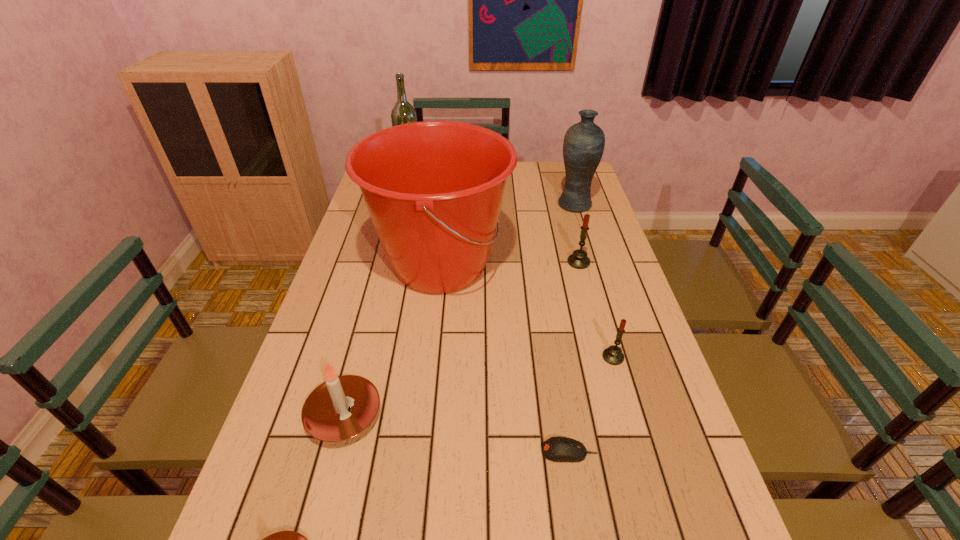
This screenshot has height=540, width=960. Find the location of `empty space that is in between the second farthest candle and the red bucket`. empty space that is in between the second farthest candle and the red bucket is located at coordinates (527, 311).

This screenshot has height=540, width=960. Identify the location of free space between the third farthest candle and the farthest object. (377, 296).

The height and width of the screenshot is (540, 960). Find the location of `vacant space in between the vase and the bucket`. vacant space in between the vase and the bucket is located at coordinates (508, 235).

Locate an element on the screen. vacant area between the third nearest candle and the red bucket is located at coordinates pos(527,311).

You are a GUI agent. You are given a task and a screenshot of the screen. Output one action in this format:
    pyautogui.click(x=<x>, y=<y>)
    Task: Click on the free space that is in between the bucket and the computer mouse
    This screenshot has height=540, width=960.
    Given the screenshot: What is the action you would take?
    pyautogui.click(x=505, y=359)

The image size is (960, 540). Find the location of `free space between the seventh nearest object and the smaller red candle`. free space between the seventh nearest object and the smaller red candle is located at coordinates (593, 281).

This screenshot has height=540, width=960. In order to click on free space between the vase and the farther white candle in this screenshot , I will do `click(459, 309)`.

Choose which object is the nearest neighbor to the blue vase. Please provide its 2D coordinates. Your answer should be formatted as a tuple, i.e. [(x, y)], where the tuple contains the x and y coordinates of a point satisfying the conditions above.

[(434, 189)]

Select which object appears as the sixth closest to the bigger white candle. Please provide its 2D coordinates. Your answer should be formatted as a tuple, i.e. [(x, y)], where the tuple contains the x and y coordinates of a point satisfying the conditions above.

[(584, 142)]

Choose which candle is the second nearest neighbor to the green liquor. Please provide its 2D coordinates. Your answer should be formatted as a tuple, i.e. [(x, y)], where the tuple contains the x and y coordinates of a point satisfying the conditions above.

[(340, 408)]